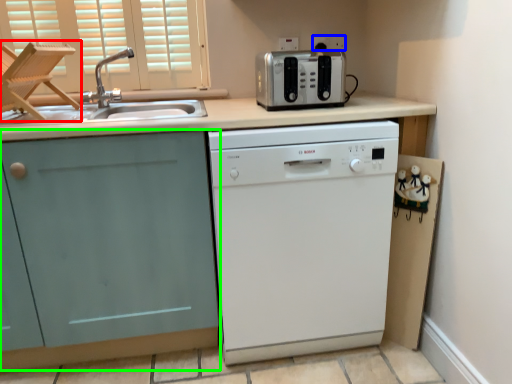
Question: Which is farther away from folding chair (highlighted by a red box)? electric outlet (highlighted by a blue box) or cabinetry (highlighted by a green box)?

Choices:
 (A) electric outlet
 (B) cabinetry

Answer: (A)